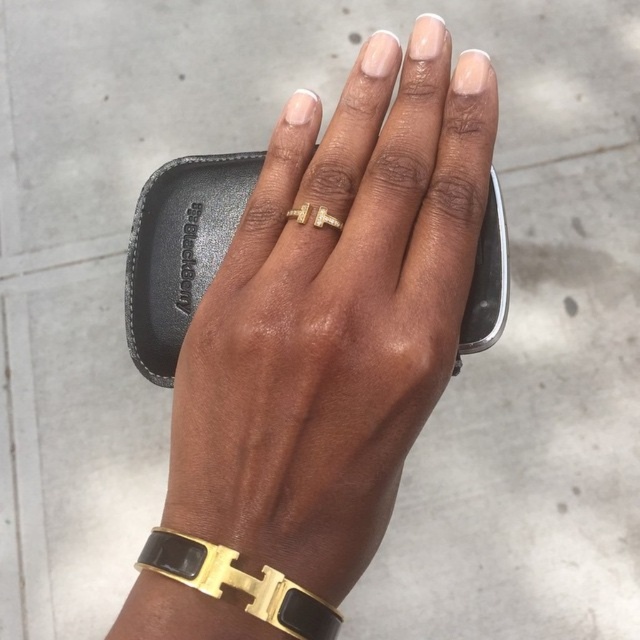
Question: Can you confirm if gold metallic ring at center is thinner than gold/black metal/bracelet at lower center?

Choices:
 (A) no
 (B) yes

Answer: (A)

Question: Which object is the closest to the gold/black metal/bracelet at lower center?

Choices:
 (A) gold metallic ring at center
 (B) gold diamond ring at center

Answer: (A)

Question: Can you confirm if gold metallic ring at center is smaller than gold diamond ring at center?

Choices:
 (A) no
 (B) yes

Answer: (A)

Question: Among these points, which one is nearest to the camera?

Choices:
 (A) (212, 294)
 (B) (289, 216)

Answer: (B)

Question: Considering the real-world distances, which object is closest to the gold/black metal/bracelet at lower center?

Choices:
 (A) gold metallic ring at center
 (B) gold diamond ring at center

Answer: (A)

Question: Is gold metallic ring at center bigger than gold diamond ring at center?

Choices:
 (A) no
 (B) yes

Answer: (B)